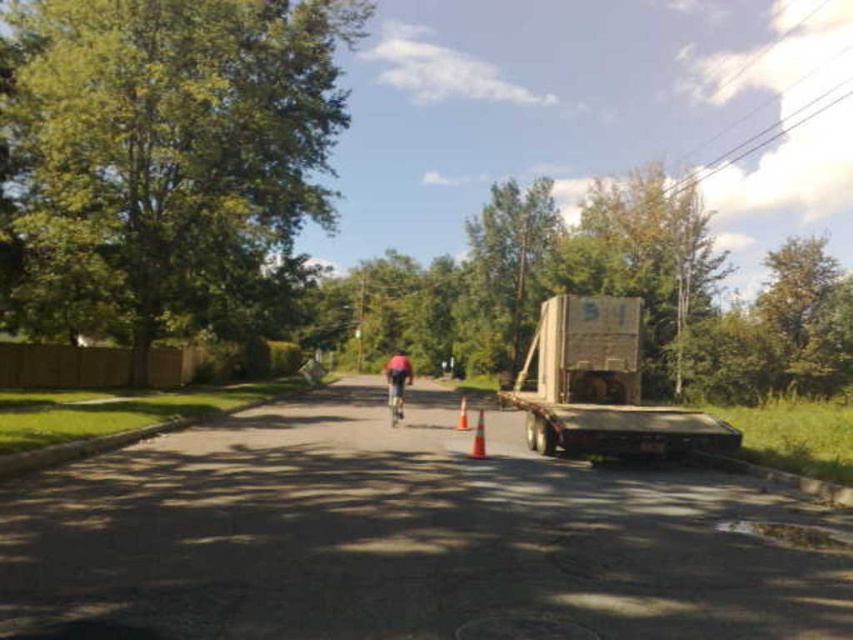
Question: Which point is closer to the camera?

Choices:
 (A) orange cone at center
 (B) orange matte traffic cone at center
 (C) shiny metallic bicycle at center
 (D) wooden crate at right

Answer: (D)

Question: Estimate the real-world distances between objects in this image. Which object is farther from the orange cone at center?

Choices:
 (A) wooden crate at right
 (B) orange matte traffic cone at center
 (C) shiny metallic bicycle at center

Answer: (A)

Question: Considering the relative positions of shiny metallic bicycle at center and orange matte traffic cone at center in the image provided, where is shiny metallic bicycle at center located with respect to orange matte traffic cone at center?

Choices:
 (A) right
 (B) left

Answer: (B)

Question: Which object is positioned closest to the wooden crate at right?

Choices:
 (A) shiny metallic bicycle at center
 (B) orange cone at center

Answer: (B)

Question: Is wooden crate at right below shiny metallic bicycle at center?

Choices:
 (A) no
 (B) yes

Answer: (A)

Question: Considering the relative positions of wooden crate at right and orange cone at center in the image provided, where is wooden crate at right located with respect to orange cone at center?

Choices:
 (A) left
 (B) right

Answer: (B)